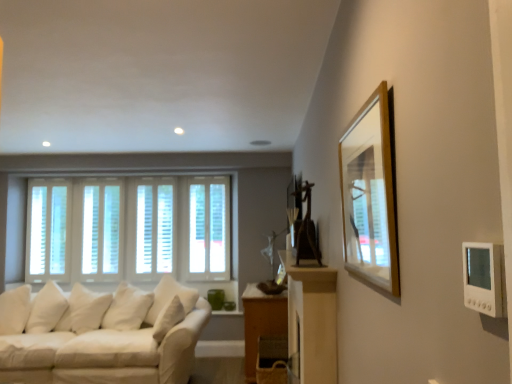
This screenshot has height=384, width=512. What do you see at coordinates (101, 228) in the screenshot?
I see `white wood window at center, which ranks as the 2th window in left-to-right order` at bounding box center [101, 228].

Describe the element at coordinates (154, 228) in the screenshot. Image resolution: width=512 pixels, height=384 pixels. I see `white wood blinds at center, marked as the second window in a right-to-left arrangement` at that location.

You are a GUI agent. You are given a task and a screenshot of the screen. Output one action in this format:
    pyautogui.click(x=<x>, y=<y>)
    Task: Click on the white fabric couch at lower left
    The width and height of the screenshot is (512, 384).
    Given the screenshot: What is the action you would take?
    pyautogui.click(x=100, y=334)

Measure the distance between point (52, 214) and camera.

5.44 meters.

What do you see at coordinates (208, 228) in the screenshot? Image resolution: width=512 pixels, height=384 pixels. I see `white wood blinds at center, positioned as the first window in right-to-left order` at bounding box center [208, 228].

Describe the element at coordinates (370, 194) in the screenshot. I see `wooden frame at upper right` at that location.

Identify the location of white wood window at center, which ranks as the 2th window in left-to-right order. (101, 228).

How many degrees apart are the facing directions of white wood window at center, which ranks as the 2th window in left-to-right order, and wooden frame at upper right?

white wood window at center, which ranks as the 2th window in left-to-right order, and wooden frame at upper right are facing 91.3 degrees away from each other.

Is point (113, 222) closer to camera compared to point (349, 144)?

That is False.

Is white wood window at center, which ranks as the 2th window in left-to-right order, outside of wooden frame at upper right?

That's correct, white wood window at center, which ranks as the 2th window in left-to-right order, is outside of wooden frame at upper right.

Considering the relative sizes of white wood window at center, acting as the 3th window starting from the right, and wooden frame at upper right in the image provided, is white wood window at center, acting as the 3th window starting from the right, shorter than wooden frame at upper right?

No.

Does white wood window at center, acting as the 3th window starting from the right, turn towards wooden table at lower center?

No, white wood window at center, acting as the 3th window starting from the right, does not turn towards wooden table at lower center.

From the image's perspective, would you say white wood window at center, which ranks as the 2th window in left-to-right order, is shown under wooden table at lower center?

No, from the image's perspective, white wood window at center, which ranks as the 2th window in left-to-right order, is not beneath wooden table at lower center.

The height and width of the screenshot is (384, 512). I want to click on table that appears on the right of white wood window at center, which ranks as the 2th window in left-to-right order, so click(x=261, y=322).

Can you confirm if wooden table at lower center is positioned to the right of white wood blinds at center, marked as the second window in a right-to-left arrangement?

Correct, you'll find wooden table at lower center to the right of white wood blinds at center, marked as the second window in a right-to-left arrangement.

In terms of size, does wooden table at lower center appear bigger or smaller than white wood blinds at center, marked as the second window in a right-to-left arrangement?

Considering their sizes, wooden table at lower center takes up more space than white wood blinds at center, marked as the second window in a right-to-left arrangement.

From a real-world perspective, is wooden table at lower center physically above white wood blinds at center, marked as the second window in a right-to-left arrangement?

No, from a real-world perspective, wooden table at lower center is not above white wood blinds at center, marked as the second window in a right-to-left arrangement.

From the image's perspective, starting from the wooden table at lower center, which window is the 1st one above? Please provide its 2D coordinates.

[(154, 228)]

Is wooden frame at upper right touching white wood blinds at left, positioned as the first window in left-to-right order?

No, wooden frame at upper right is not with white wood blinds at left, positioned as the first window in left-to-right order.

Consider the image. Is wooden frame at upper right turned away from white wood blinds at left, which appears as the 4th window when viewed from the right?

No, wooden frame at upper right's orientation is not away from white wood blinds at left, which appears as the 4th window when viewed from the right.

Is white wood blinds at left, which appears as the 4th window when viewed from the right, inside wooden frame at upper right?

No, white wood blinds at left, which appears as the 4th window when viewed from the right, is not a part of wooden frame at upper right.

Starting from the wooden frame at upper right, which window is the 4th one to the left? Please provide its 2D coordinates.

[(49, 230)]

Image resolution: width=512 pixels, height=384 pixels. I want to click on table above the white fabric couch at lower left (from a real-world perspective), so click(261, 322).

Who is more distant, white fabric couch at lower left or wooden table at lower center?

wooden table at lower center is further from the camera.

Between white fabric couch at lower left and wooden table at lower center, which one appears on the right side from the viewer's perspective?

wooden table at lower center.

Based on the photo, considering the positions of objects white wood window at center, which ranks as the 2th window in left-to-right order, and white fabric couch at lower left in the image provided, who is in front, white wood window at center, which ranks as the 2th window in left-to-right order, or white fabric couch at lower left?

white fabric couch at lower left is in front.

Does point (93, 207) come farther from viewer compared to point (149, 378)?

Yes, point (93, 207) is farther from viewer.

From the image's perspective, would you say white wood window at center, acting as the 3th window starting from the right, is positioned over white fabric couch at lower left?

Indeed, from the image's perspective, white wood window at center, acting as the 3th window starting from the right, is shown above white fabric couch at lower left.

From a real-world perspective, is white wood blinds at center, positioned as the first window in right-to-left order, below wooden table at lower center?

No, from a real-world perspective, white wood blinds at center, positioned as the first window in right-to-left order, is not beneath wooden table at lower center.

Which of these two, white wood blinds at center, positioned as the first window in right-to-left order, or wooden table at lower center, is wider?

wooden table at lower center is wider.

Considering the sizes of objects white wood blinds at center, which is counted as the fourth window, starting from the left, and wooden table at lower center in the image provided, who is shorter, white wood blinds at center, which is counted as the fourth window, starting from the left, or wooden table at lower center?

With less height is wooden table at lower center.

At what (x,y) coordinates should I click in order to perform the action: click on picture frame located on the right of white wood window at center, acting as the 3th window starting from the right. Please return your answer as a coordinate pair (x, y). Image resolution: width=512 pixels, height=384 pixels. Looking at the image, I should click on (370, 194).

Find the location of `table below the white wood window at center, which ranks as the 2th window in left-to-right order (from a real-world perspective)`. table below the white wood window at center, which ranks as the 2th window in left-to-right order (from a real-world perspective) is located at coordinates (261, 322).

When comparing their distances from wooden frame at upper right, does white fabric couch at lower left or white wood blinds at center, positioned as the first window in right-to-left order, seem further?

Among the two, white wood blinds at center, positioned as the first window in right-to-left order, is located further to wooden frame at upper right.

Based on the photo, from the image, which object appears to be nearer to wooden table at lower center, wooden frame at upper right or white wood window at center, acting as the 3th window starting from the right?

The object closer to wooden table at lower center is white wood window at center, acting as the 3th window starting from the right.

Which object lies nearer to the anchor point wooden frame at upper right, white wood blinds at center, marked as the second window in a right-to-left arrangement, or white fabric couch at lower left?

white fabric couch at lower left is positioned closer to the anchor wooden frame at upper right.

When comparing their distances from white fabric couch at lower left, does wooden table at lower center or white wood blinds at center, marked as the second window in a right-to-left arrangement, seem further?

white wood blinds at center, marked as the second window in a right-to-left arrangement, is positioned further to the anchor white fabric couch at lower left.

Which object lies nearer to the anchor point white wood blinds at left, which appears as the 4th window when viewed from the right, wooden table at lower center or wooden frame at upper right?

wooden table at lower center is closer to white wood blinds at left, which appears as the 4th window when viewed from the right.

Based on their spatial positions, is wooden table at lower center or white wood window at center, which ranks as the 2th window in left-to-right order, further from white fabric couch at lower left?

white wood window at center, which ranks as the 2th window in left-to-right order, is further to white fabric couch at lower left.

Based on the photo, when comparing their distances from white fabric couch at lower left, does white wood blinds at center, placed as the third window when sorted from left to right, or white wood blinds at left, which appears as the 4th window when viewed from the right, seem closer?

The object closer to white fabric couch at lower left is white wood blinds at center, placed as the third window when sorted from left to right.

Based on their spatial positions, is white wood blinds at left, which appears as the 4th window when viewed from the right, or white wood blinds at center, positioned as the first window in right-to-left order, further from wooden table at lower center?

Among the two, white wood blinds at left, which appears as the 4th window when viewed from the right, is located further to wooden table at lower center.

Image resolution: width=512 pixels, height=384 pixels. What are the coordinates of `studio couch located between wooden frame at upper right and white wood blinds at center, placed as the third window when sorted from left to right, in the depth direction` in the screenshot? It's located at (100, 334).

You are a GUI agent. You are given a task and a screenshot of the screen. Output one action in this format:
    pyautogui.click(x=<x>, y=<y>)
    Task: Click on the studio couch located between wooden frame at upper right and white wood window at center, which ranks as the 2th window in left-to-right order, in the depth direction
    The width and height of the screenshot is (512, 384).
    Given the screenshot: What is the action you would take?
    click(100, 334)

At what (x,y) coordinates should I click in order to perform the action: click on table between wooden frame at upper right and white wood blinds at left, positioned as the first window in left-to-right order, in the front-back direction. Please return your answer as a coordinate pair (x, y). Looking at the image, I should click on (261, 322).

At what (x,y) coordinates should I click in order to perform the action: click on table between wooden frame at upper right and white wood blinds at center, which is counted as the fourth window, starting from the left, in the front-back direction. Please return your answer as a coordinate pair (x, y). Image resolution: width=512 pixels, height=384 pixels. Looking at the image, I should click on (261, 322).